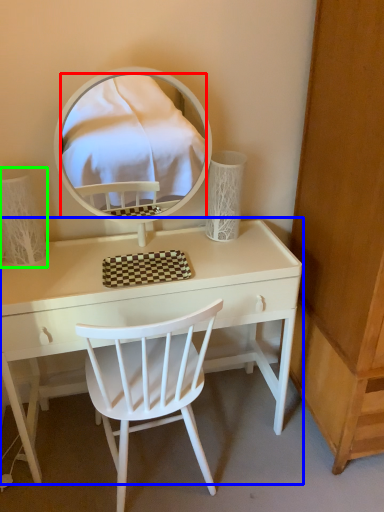
Question: Which object is the closest to the mirror (highlighted by a red box)? Choose among these: table (highlighted by a blue box) or table lamp (highlighted by a green box).

Choices:
 (A) table
 (B) table lamp

Answer: (A)